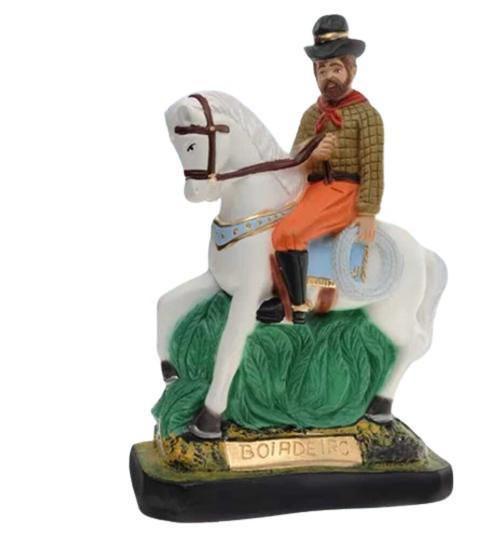
At what (x,y) coordinates should I click in order to perform the action: click on base of figurine. Please return your answer as a coordinate pair (x, y). The width and height of the screenshot is (504, 540). Looking at the image, I should click on (216, 501), (400, 485), (307, 501).